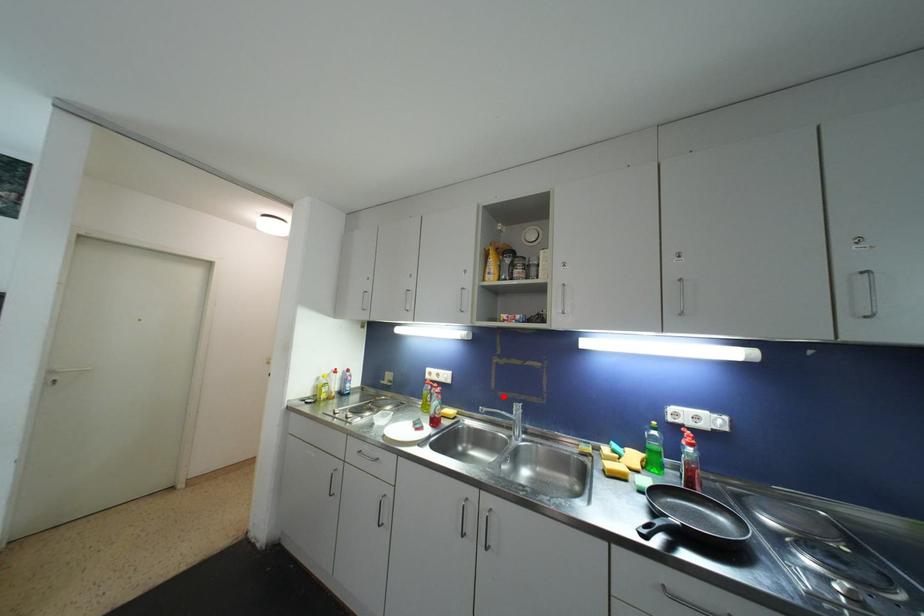
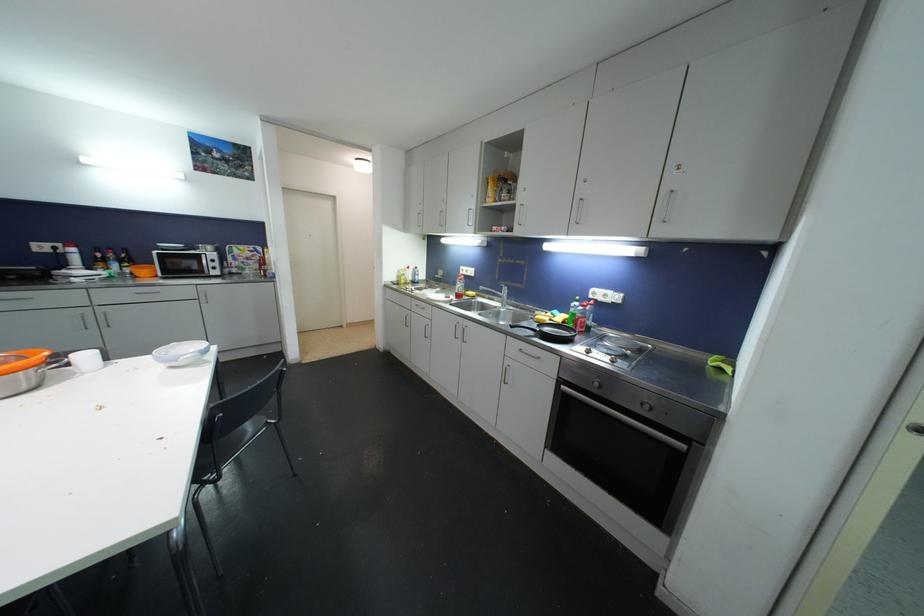
In the second image, find the point that corresponds to the highlighted location in the first image.

(504, 285)